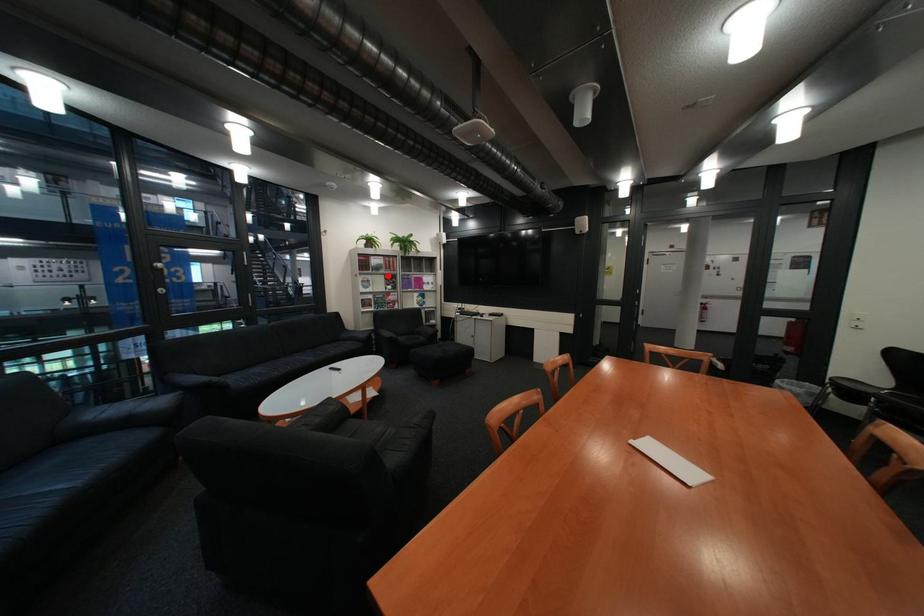
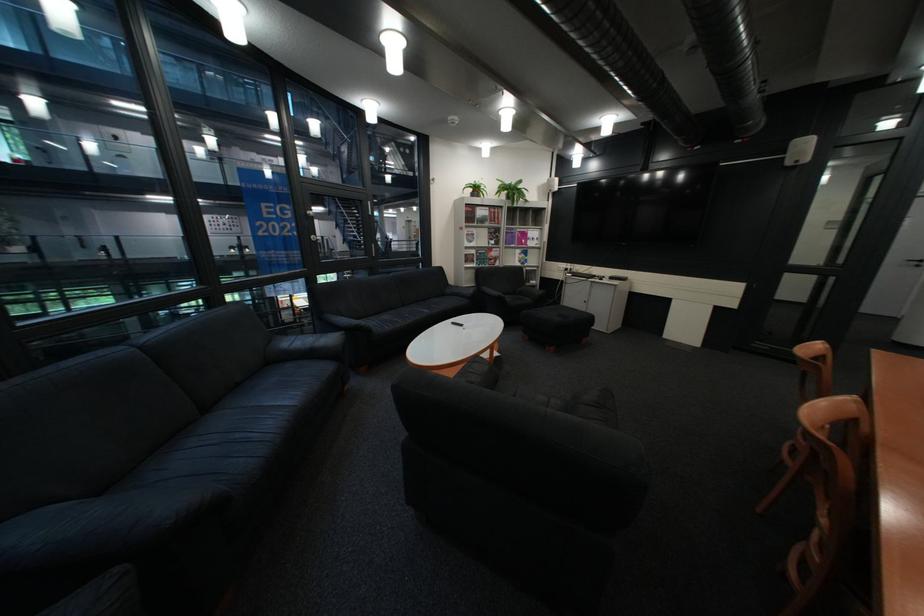
Question: A red point is marked in image1. In image2, is the corresponding 3D point closer to the camera or farther? Reply with the corresponding letter.

Choices:
 (A) The corresponding 3D point is closer.
 (B) The corresponding 3D point is farther.

Answer: (A)